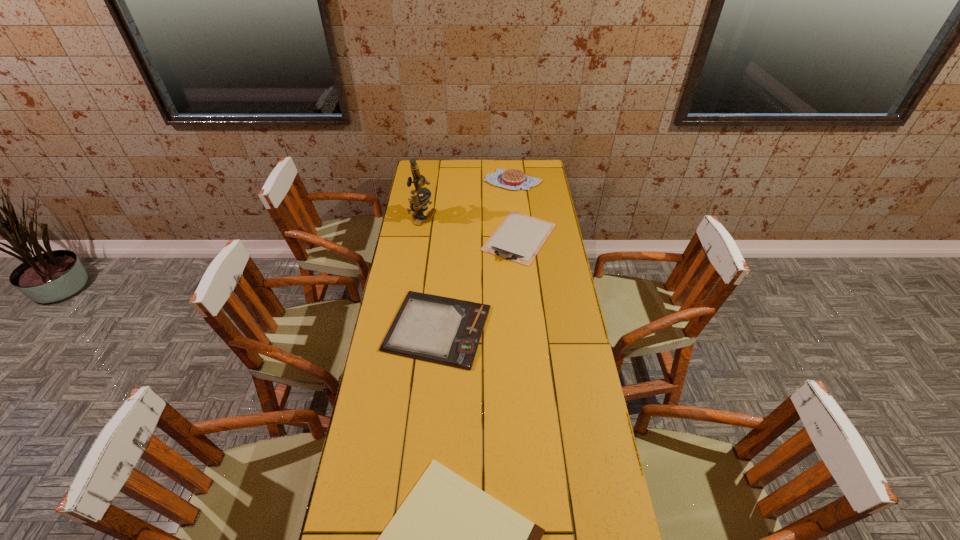
Locate an element on the screen. clipboard that is the second closest one to the second nearest clipboard is located at coordinates (449, 539).

Locate an element on the screen. The image size is (960, 540). free space that satisfies the following two spatial constraints: 1. on the back side of the pie; 2. on the right side of the microscope is located at coordinates (428, 180).

Identify the location of free spot that satisfies the following two spatial constraints: 1. on the front side of the microscope; 2. on the right side of the second nearest object. (405, 328).